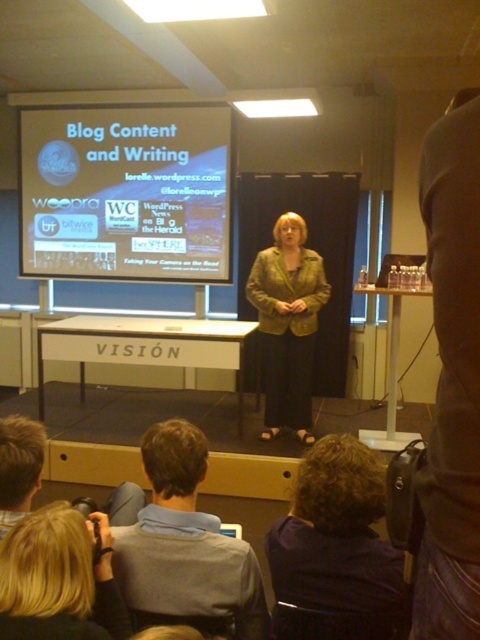
Question: Can you confirm if gray fabric shirt at center is positioned to the right of matte gold jacket at center?

Choices:
 (A) no
 (B) yes

Answer: (A)

Question: Which of the following is the closest to the observer?

Choices:
 (A) (368, 586)
 (B) (145, 125)

Answer: (A)

Question: Which of the following is the closest to the observer?

Choices:
 (A) matte gold jacket at center
 (B) gray fabric shirt at center

Answer: (B)

Question: Which object is farther from the camera taking this photo?

Choices:
 (A) dark blue fabric at lower center
 (B) matte gold jacket at center
 (C) white matte projection screen at upper center

Answer: (C)

Question: Is white matte projection screen at upper center below blonde hair at lower left?

Choices:
 (A) no
 (B) yes

Answer: (A)

Question: Is blonde hair at lower left smaller than matte gold jacket at center?

Choices:
 (A) yes
 (B) no

Answer: (A)